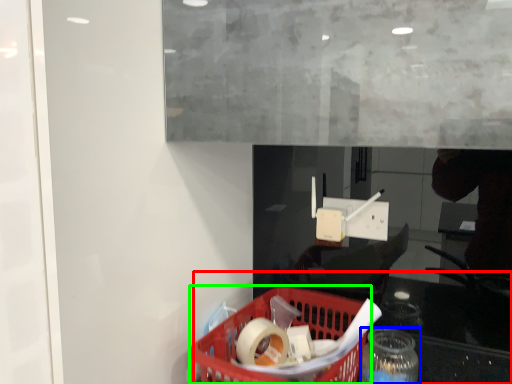
Question: Estimate the real-world distances between objects in this image. Which object is closer to table (highlighted by a red box), bottle (highlighted by a blue box) or basket (highlighted by a green box)?

Choices:
 (A) bottle
 (B) basket

Answer: (B)